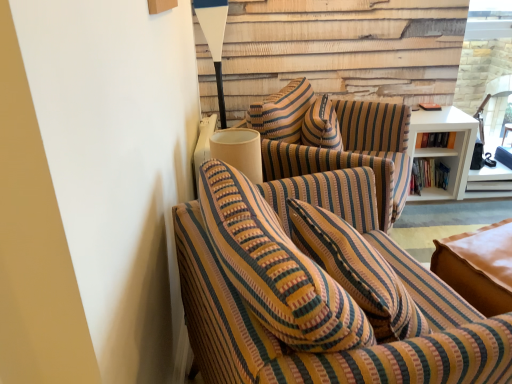
Question: Considering the relative sizes of clear glass door at upper right and striped fabric couch at center, which ranks as the first studio couch in front-to-back order, in the image provided, is clear glass door at upper right taller than striped fabric couch at center, which ranks as the first studio couch in front-to-back order,?

Choices:
 (A) no
 (B) yes

Answer: (B)

Question: From the image's perspective, is clear glass door at upper right located above striped fabric couch at center, which ranks as the first studio couch in front-to-back order?

Choices:
 (A) yes
 (B) no

Answer: (A)

Question: Is clear glass door at upper right oriented away from striped fabric couch at center, which ranks as the first studio couch in front-to-back order?

Choices:
 (A) yes
 (B) no

Answer: (B)

Question: Considering the relative sizes of clear glass door at upper right and striped fabric couch at center, which ranks as the first studio couch in front-to-back order, in the image provided, is clear glass door at upper right shorter than striped fabric couch at center, which ranks as the first studio couch in front-to-back order,?

Choices:
 (A) no
 (B) yes

Answer: (A)

Question: Is clear glass door at upper right with striped fabric couch at center, which ranks as the first studio couch in front-to-back order?

Choices:
 (A) no
 (B) yes

Answer: (A)

Question: Does clear glass door at upper right have a smaller size compared to striped fabric couch at center, the 2th studio couch positioned from the back?

Choices:
 (A) no
 (B) yes

Answer: (B)

Question: Does white glossy table lamp at upper center have a greater width compared to white matte shelf at right?

Choices:
 (A) no
 (B) yes

Answer: (A)

Question: From a real-world perspective, is white glossy table lamp at upper center physically below white matte shelf at right?

Choices:
 (A) yes
 (B) no

Answer: (B)

Question: Is white glossy table lamp at upper center thinner than white matte shelf at right?

Choices:
 (A) yes
 (B) no

Answer: (A)

Question: Can you confirm if white glossy table lamp at upper center is taller than white matte shelf at right?

Choices:
 (A) no
 (B) yes

Answer: (B)

Question: Considering the relative positions of white glossy table lamp at upper center and white matte shelf at right in the image provided, is white glossy table lamp at upper center to the left of white matte shelf at right from the viewer's perspective?

Choices:
 (A) no
 (B) yes

Answer: (B)

Question: Is white glossy table lamp at upper center shorter than white matte shelf at right?

Choices:
 (A) no
 (B) yes

Answer: (A)

Question: Does white matte shelf at right come behind striped fabric couch at center, the first studio couch positioned from the back?

Choices:
 (A) yes
 (B) no

Answer: (A)